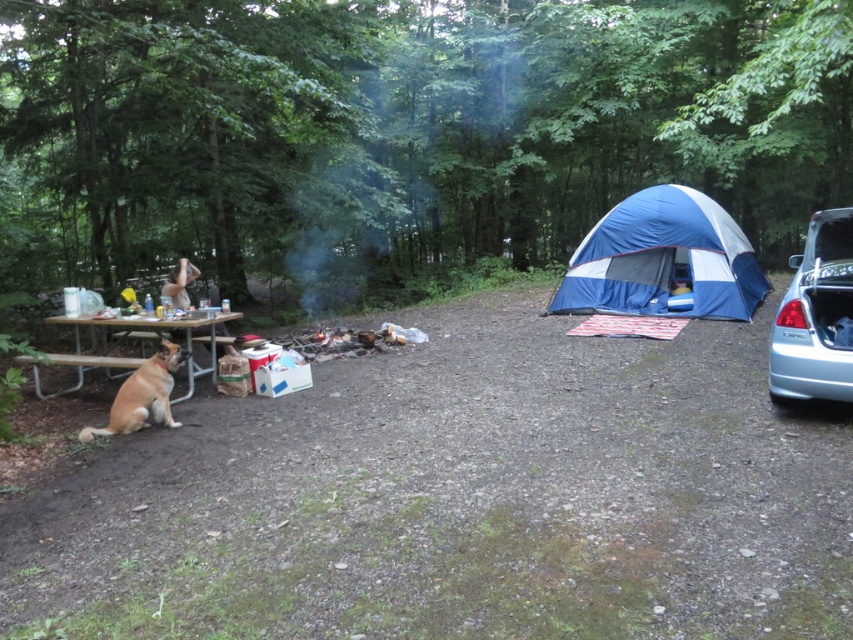
Question: Can you confirm if light blue metallic car at right is thinner than brown fur dog at left?

Choices:
 (A) yes
 (B) no

Answer: (B)

Question: Can you confirm if blue/white fabric tent at right is bigger than wooden picnic table at left?

Choices:
 (A) no
 (B) yes

Answer: (B)

Question: Which object is closer to the camera taking this photo?

Choices:
 (A) light blue metallic car at right
 (B) brown fur dog at left
 (C) wooden picnic table at left
 (D) blue/white fabric tent at right

Answer: (A)

Question: Estimate the real-world distances between objects in this image. Which object is farther from the brown fur dog at left?

Choices:
 (A) light blue metallic car at right
 (B) blue/white fabric tent at right
 (C) wooden picnic table at left

Answer: (B)

Question: Which of the following is the closest to the observer?

Choices:
 (A) (x=836, y=356)
 (B) (x=602, y=220)
 (C) (x=125, y=387)

Answer: (A)

Question: Is blue/white fabric tent at right smaller than brown fur dog at left?

Choices:
 (A) yes
 (B) no

Answer: (B)